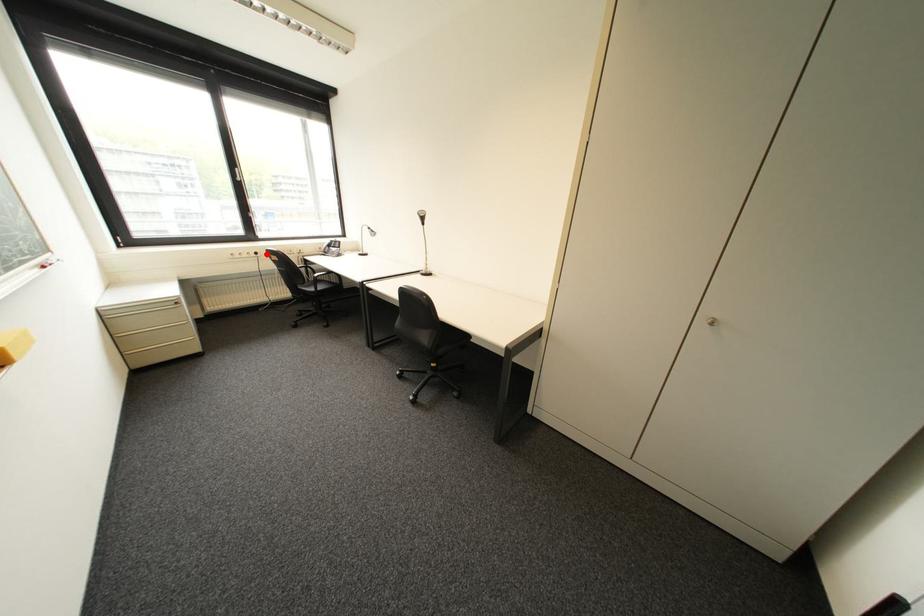
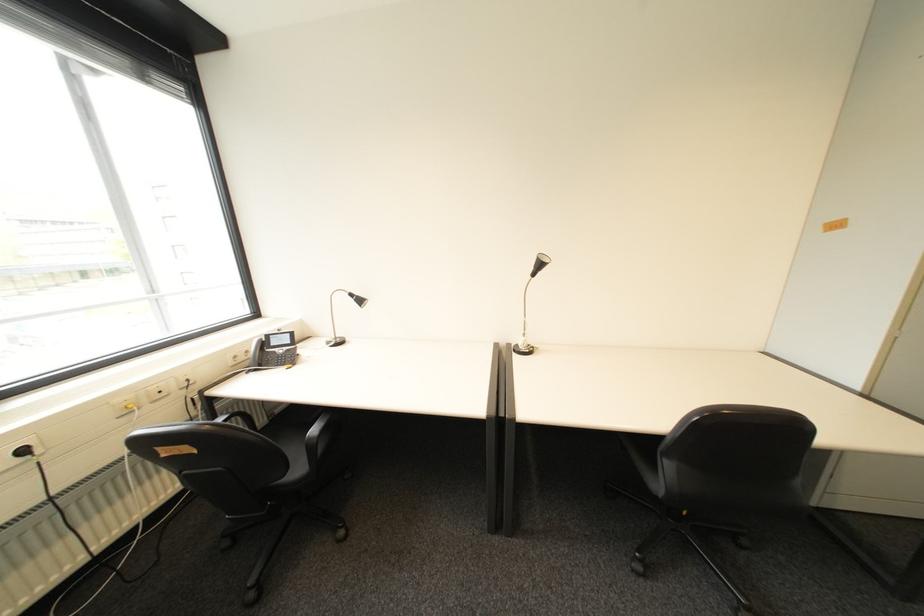
Find the pixel in the second image that matches the highlighted location in the first image.

(34, 452)